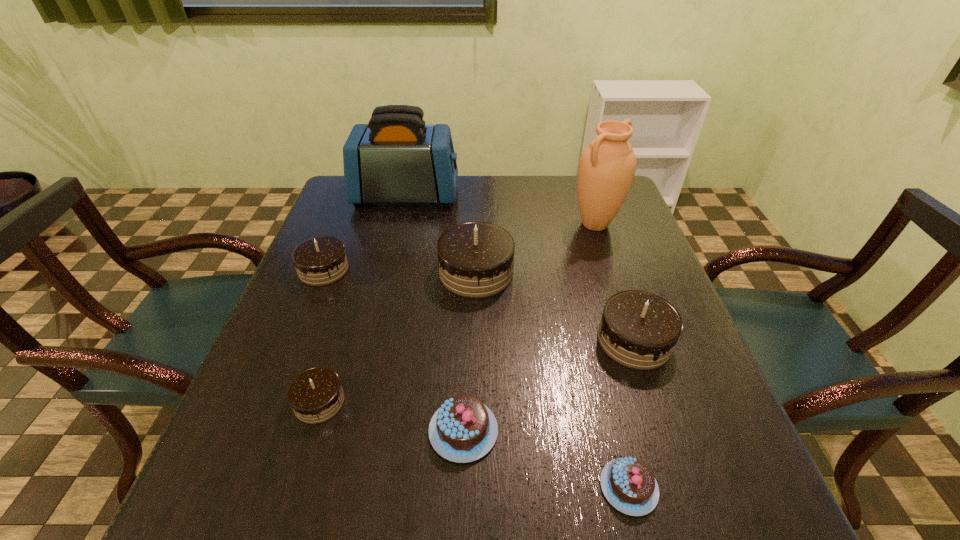
You are a GUI agent. You are given a task and a screenshot of the screen. Output one action in this format:
    pyautogui.click(x=<x>, y=<y>)
    Task: Click on the free space at the right edge of the desktop
    
    Given the screenshot: What is the action you would take?
    pyautogui.click(x=635, y=288)

Where is `unoccupied position between the urn and the toaster`? unoccupied position between the urn and the toaster is located at coordinates (500, 210).

I want to click on free space between the nearest chocolate chocolate cake and the tallest chocolate cake, so click(x=397, y=337).

At what (x,y) coordinates should I click in order to perform the action: click on free point between the shortest object and the fourth shortest object. Please return your answer as a coordinate pair (x, y). Looking at the image, I should click on (476, 378).

At what (x,y) coordinates should I click in order to perform the action: click on vacant area between the urn and the bigger pink chocolate cake. Please return your answer as a coordinate pair (x, y). This screenshot has height=540, width=960. Looking at the image, I should click on [x=529, y=327].

Find the location of a particular element. This screenshot has width=960, height=540. free spot between the fourth nearest object and the urn is located at coordinates (614, 282).

Locate an element on the screen. This screenshot has width=960, height=540. free space between the second chocolate chocolate cake from right to left and the rightmost chocolate chocolate cake is located at coordinates (555, 306).

The width and height of the screenshot is (960, 540). I want to click on free space between the second smallest chocolate chocolate cake and the tallest chocolate cake, so click(400, 271).

At what (x,y) coordinates should I click in order to perform the action: click on vacant area between the blue toaster and the shortest chocolate cake. Please return your answer as a coordinate pair (x, y). This screenshot has width=960, height=540. Looking at the image, I should click on (517, 341).

The width and height of the screenshot is (960, 540). I want to click on empty space that is in between the fourth nearest object and the third tallest chocolate cake, so click(479, 305).